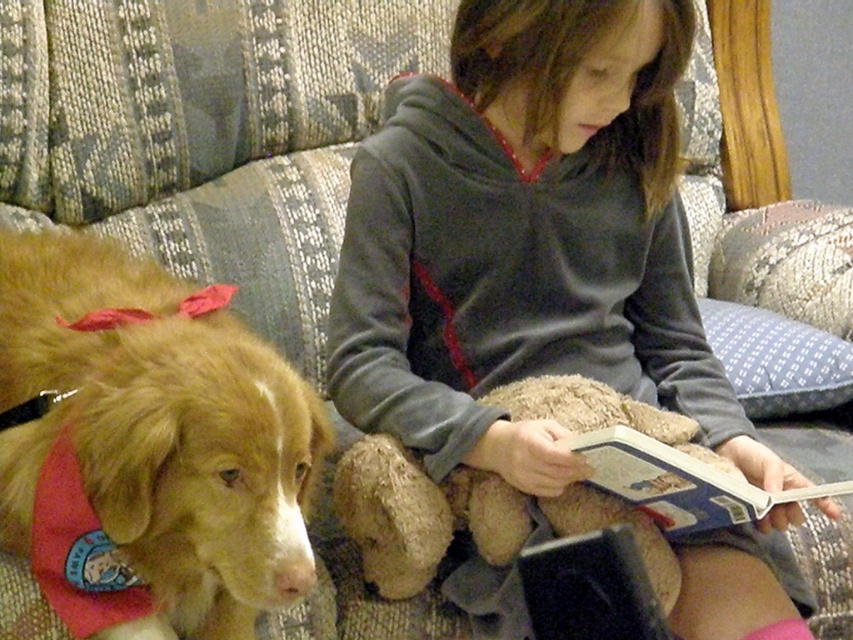
You are a delivery robot that needs to place a small package between the golden fur dog at left and the hardcover book at center. Can you fit it there if the package is 16 inches long?

The distance between the golden fur dog at left and the hardcover book at center is 18.00 inches. Since the package is 16 inches long, it can fit in the space between them.

You are a photographer positioned at the center of the room. You want to take a photo of the golden fur dog at left. Where should you aim your camera to capture it in the frame?

You should aim your camera at the point (148, 445) to capture the golden fur dog at left in the frame.